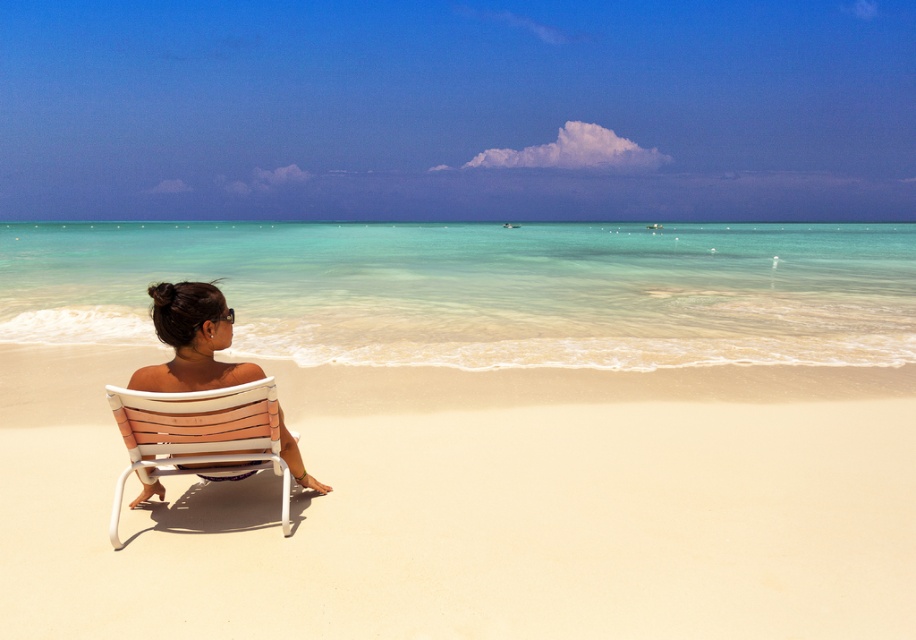
Question: Which point is closer to the camera?

Choices:
 (A) beige sand at center
 (B) matte white chair at center

Answer: (B)

Question: Is beige sand at center in front of matte white chair at center?

Choices:
 (A) no
 (B) yes

Answer: (A)

Question: Is white woven plastic chair at lower left thinner than matte white chair at center?

Choices:
 (A) no
 (B) yes

Answer: (B)

Question: Is white woven plastic chair at lower left smaller than matte white chair at center?

Choices:
 (A) yes
 (B) no

Answer: (A)

Question: Among these objects, which one is nearest to the camera?

Choices:
 (A) white woven plastic chair at lower left
 (B) matte white chair at center

Answer: (B)

Question: Which object is the farthest from the beige sand at center?

Choices:
 (A) matte white chair at center
 (B) white woven plastic chair at lower left

Answer: (A)